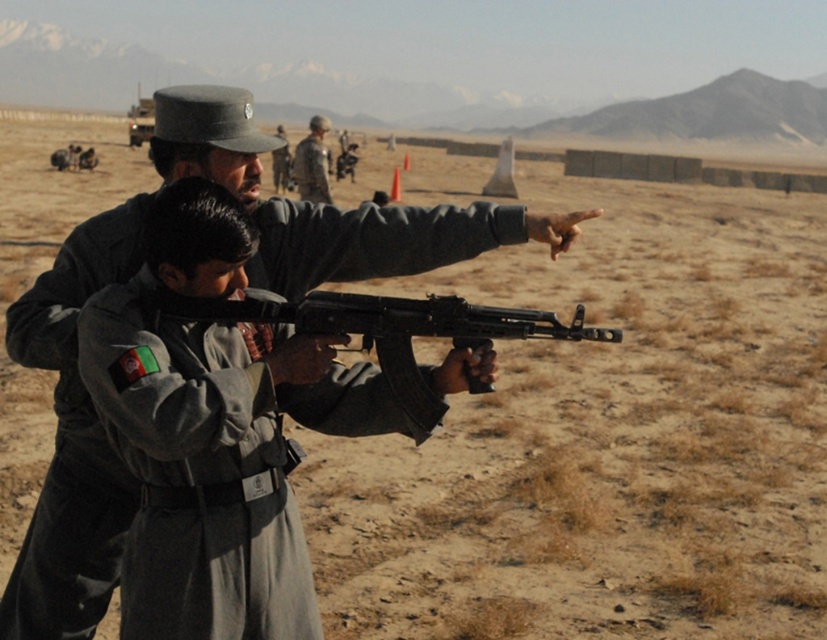
Question: In this image, where is matte black rifle at center located relative to camouflage fabric uniform at center?

Choices:
 (A) left
 (B) right

Answer: (B)

Question: Which point is farther from the camera taking this photo?

Choices:
 (A) 304,173
 (B) 388,332

Answer: (A)

Question: Does matte black rifle at center have a lesser width compared to camouflage fabric uniform at center?

Choices:
 (A) no
 (B) yes

Answer: (B)

Question: Which point appears farthest from the camera in this image?

Choices:
 (A) (x=572, y=337)
 (B) (x=311, y=124)

Answer: (B)

Question: In this image, where is matte black rifle at center located relative to camouflage fabric uniform at center?

Choices:
 (A) left
 (B) right

Answer: (B)